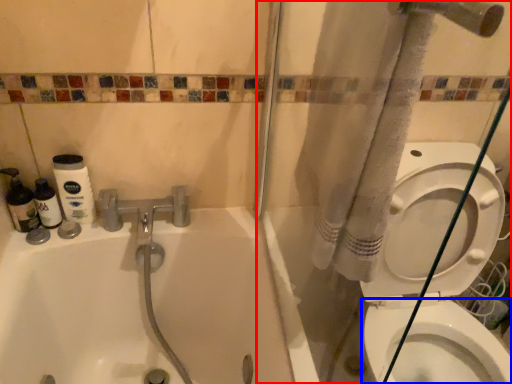
Question: Which of the following is the closest to the observer, shower door (highlighted by a red box) or bidet (highlighted by a blue box)?

Choices:
 (A) shower door
 (B) bidet

Answer: (A)